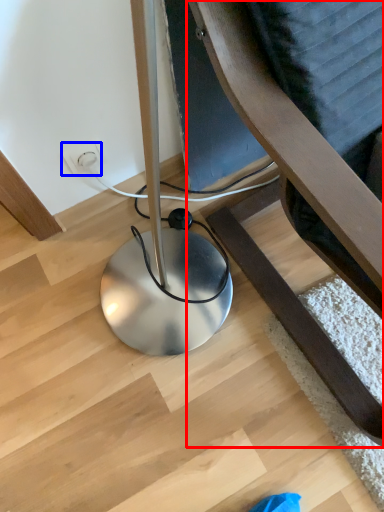
Question: Among these objects, which one is nearest to the camera, furniture (highlighted by a red box) or electric outlet (highlighted by a blue box)?

Choices:
 (A) furniture
 (B) electric outlet

Answer: (A)